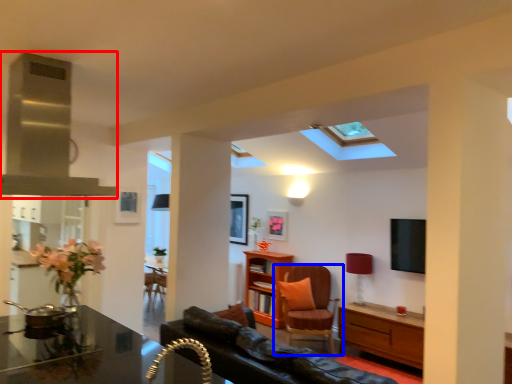
Question: Which object appears closest to the camera in this image, exhaust hood (highlighted by a red box) or chair (highlighted by a blue box)?

Choices:
 (A) exhaust hood
 (B) chair

Answer: (A)